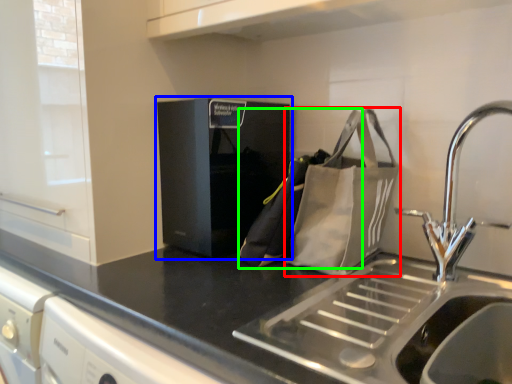
Question: Considering the real-world distances, which object is farthest from pouch (highlighted by a red box)? home appliance (highlighted by a blue box) or messenger bag (highlighted by a green box)?

Choices:
 (A) home appliance
 (B) messenger bag

Answer: (A)